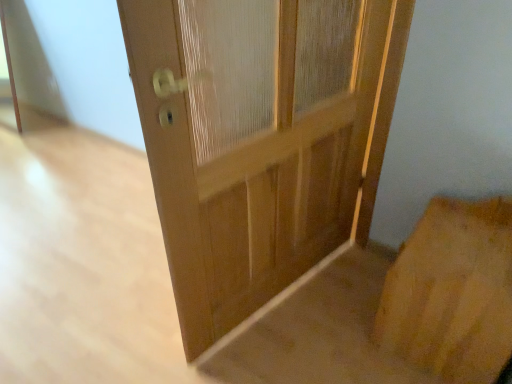
The height and width of the screenshot is (384, 512). I want to click on free area below natural wood door at center (from a real-world perspective), so coord(281,291).